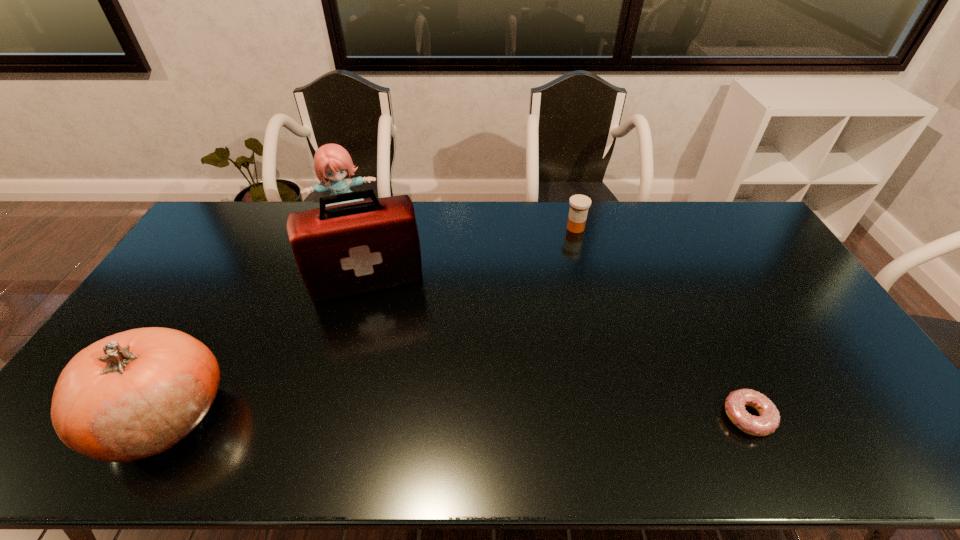
The width and height of the screenshot is (960, 540). What are the coordinates of `pumpkin that is positioned at the near edge` in the screenshot? It's located at (135, 394).

At what (x,y) coordinates should I click in order to perform the action: click on doughnut at the near edge. Please return your answer as a coordinate pair (x, y). Looking at the image, I should click on (x=768, y=421).

The image size is (960, 540). In order to click on object that is at the left edge in this screenshot , I will do `click(135, 394)`.

Locate an element on the screen. object that is at the near left corner is located at coordinates (135, 394).

The image size is (960, 540). Find the location of `vacant space at the far edge`. vacant space at the far edge is located at coordinates (560, 225).

At what (x,y) coordinates should I click in order to perform the action: click on free point at the near edge. Please return your answer as a coordinate pair (x, y). This screenshot has height=540, width=960. Looking at the image, I should click on (713, 415).

At what (x,y) coordinates should I click in order to perform the action: click on vacant area at the left edge of the desktop. Please return your answer as a coordinate pair (x, y). The width and height of the screenshot is (960, 540). Looking at the image, I should click on (195, 294).

Locate an element on the screen. The width and height of the screenshot is (960, 540). vacant space at the right edge of the desktop is located at coordinates (810, 360).

I want to click on vacant area that lies between the rightmost object and the third nearest object, so click(x=558, y=349).

The image size is (960, 540). I want to click on vacant space that is in between the pumpkin and the medicine, so click(370, 322).